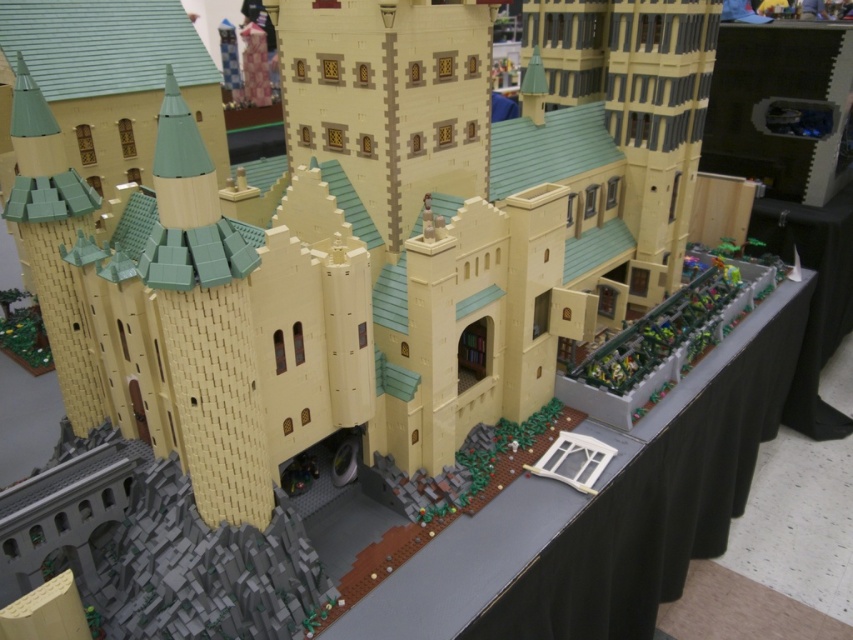
Looking at this image, what are the coordinates of the light yellow brick castle at center?

The light yellow brick castle at center is located at coordinates point (368, 240).

You are standing in front of the LEGO castle and want to determine which of the two points, point [450,378] or point [598,621], is closer to you. Based on the description, which point is nearer?

Point [450,378] is closer to the viewer than point [598,621].